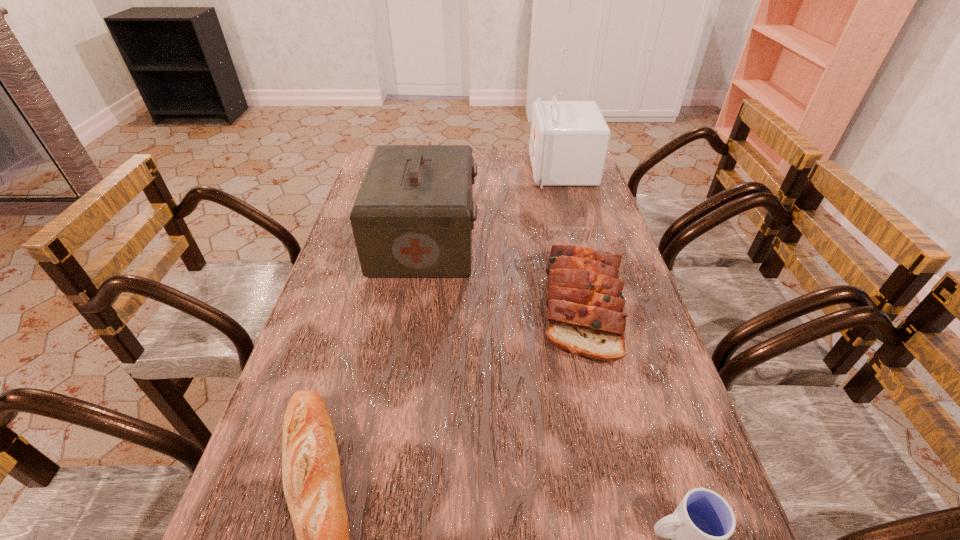
Where is `object that is the fourth nearest to the cup`? This screenshot has width=960, height=540. object that is the fourth nearest to the cup is located at coordinates (569, 140).

Where is `object that is the fourth closest to the baguet`? The image size is (960, 540). object that is the fourth closest to the baguet is located at coordinates (569, 140).